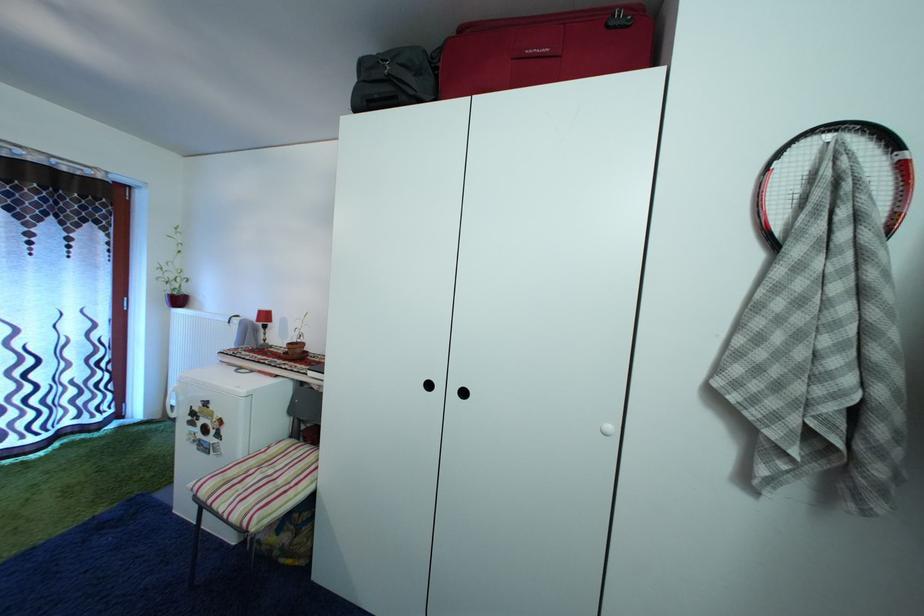
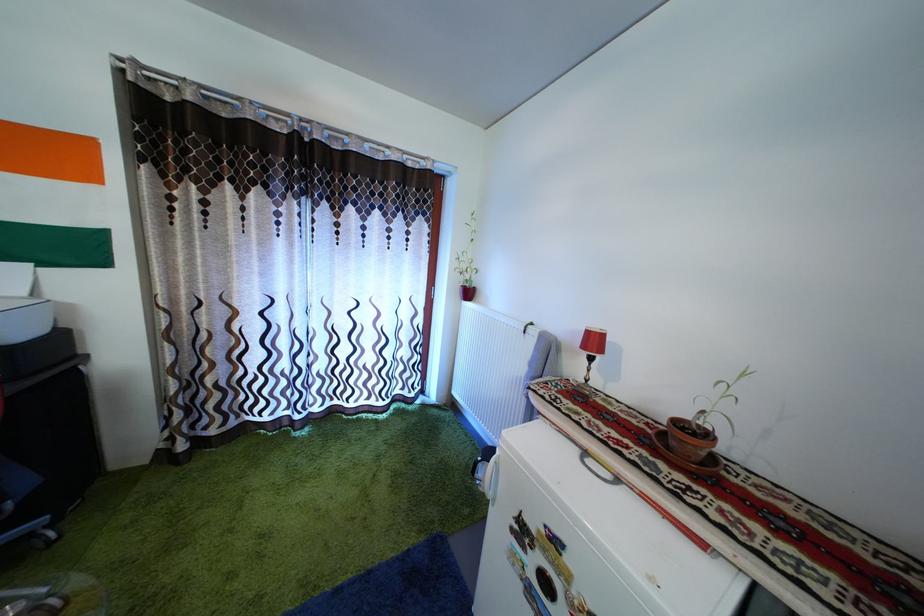
Find the pixel in the second image that matches the point at 268,320 in the first image.

(598, 339)